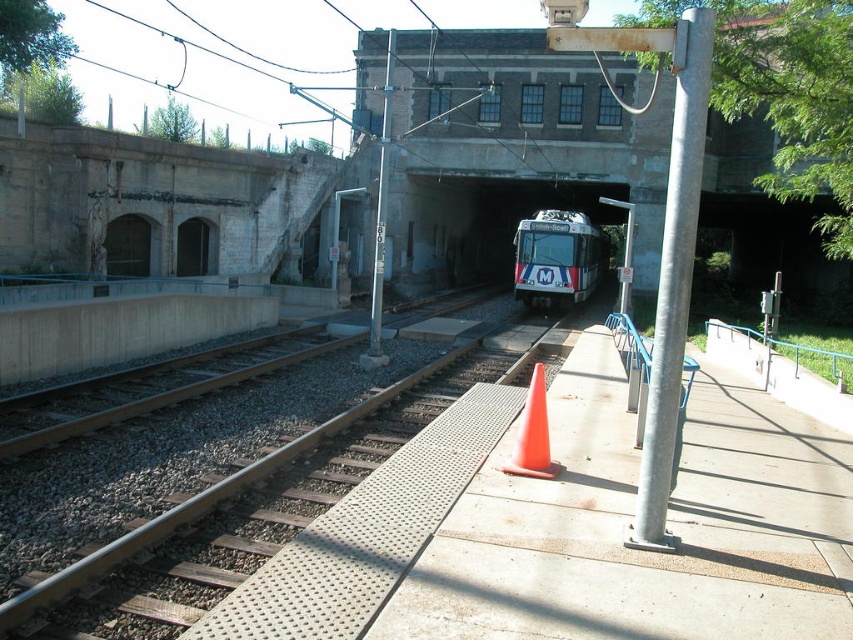
Question: Which point is farther from the camera taking this photo?

Choices:
 (A) (550, 252)
 (B) (541, 440)

Answer: (A)

Question: Which point appears closest to the camera in this image?

Choices:
 (A) (206, 588)
 (B) (126, 403)
 (C) (518, 433)
 (D) (593, 289)

Answer: (A)

Question: Can you confirm if gray gravel train track at center is smaller than brown gravel train track at center?

Choices:
 (A) no
 (B) yes

Answer: (B)

Question: Does white glossy train at center have a larger size compared to brown gravel train track at center?

Choices:
 (A) no
 (B) yes

Answer: (B)

Question: Does brown gravel train track at center have a greater width compared to orange matte traffic cone at center?

Choices:
 (A) no
 (B) yes

Answer: (B)

Question: Among these points, which one is nearest to the camera?

Choices:
 (A) (526, 358)
 (B) (462, 307)
 (C) (538, 397)

Answer: (C)